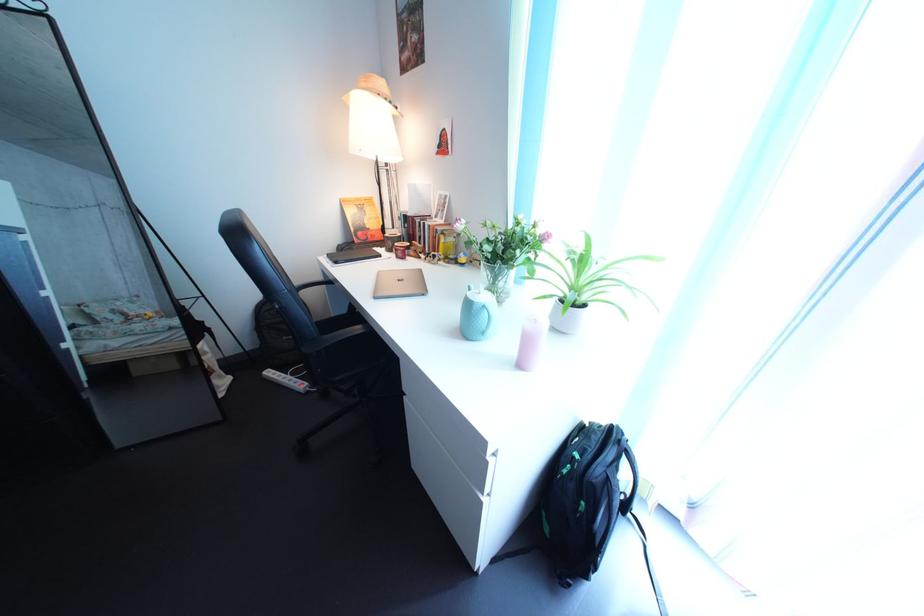
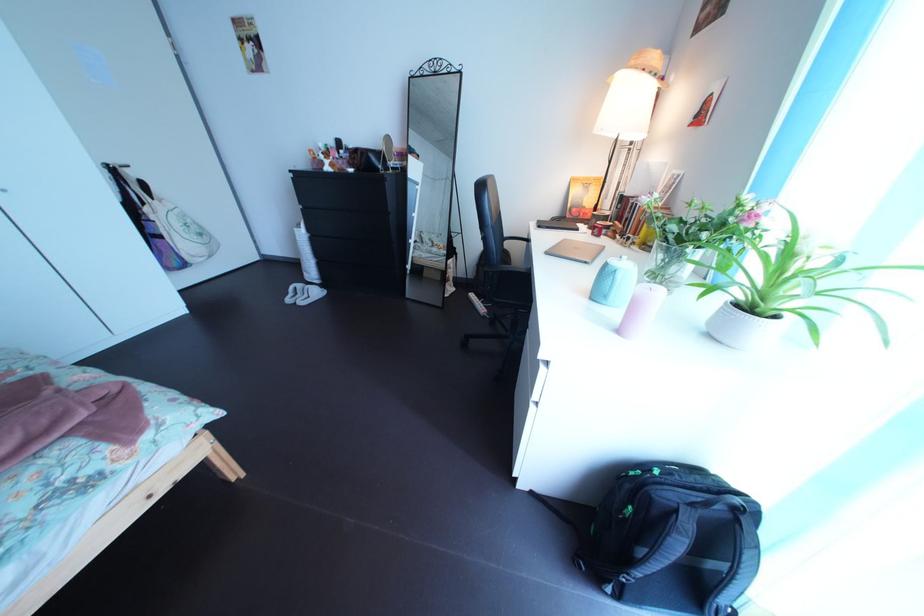
Find the pixel in the second image that matches (591,464) in the first image.

(672, 480)